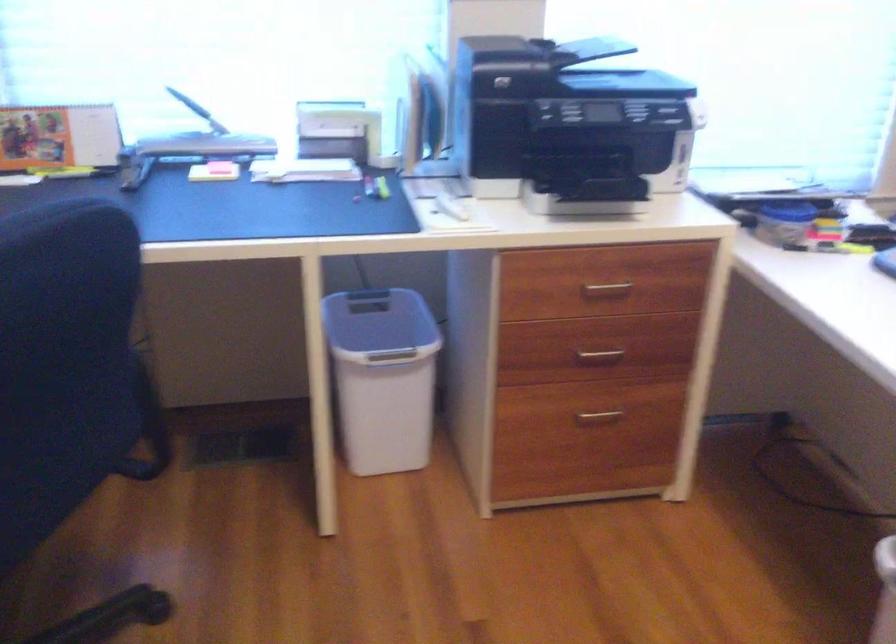
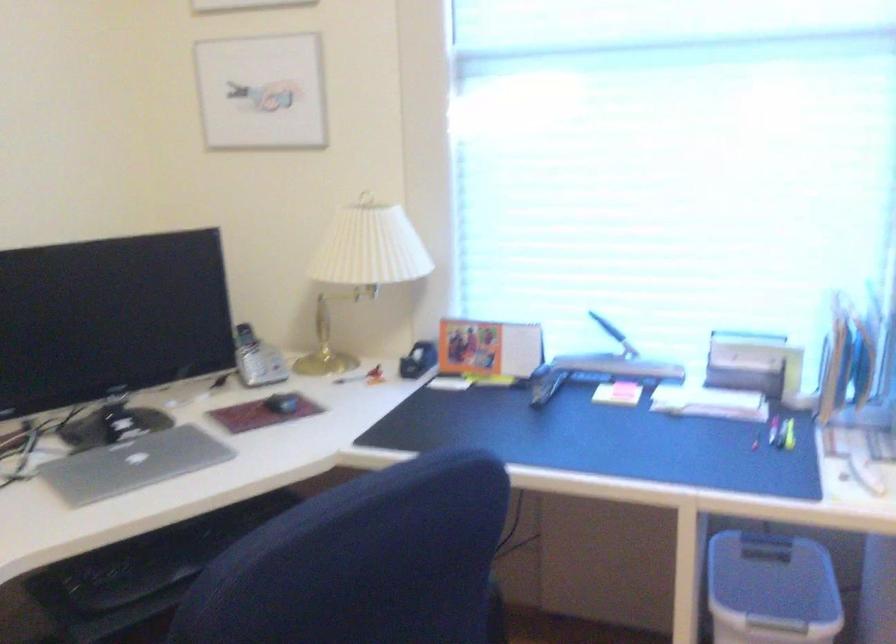
Where in the second image is the point corresponding to (x=375, y=337) from the first image?

(771, 589)